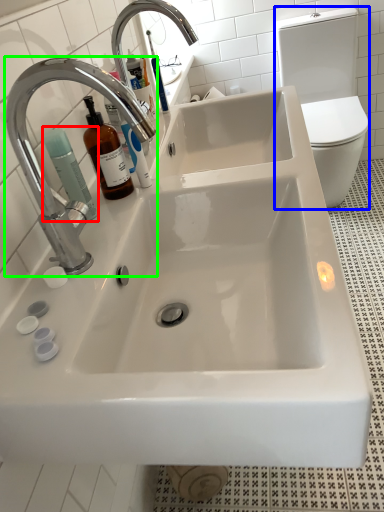
Question: Which object is the farthest from cleaning product (highlighted by a red box)? Choose among these: toilet bowl (highlighted by a blue box) or tap (highlighted by a green box).

Choices:
 (A) toilet bowl
 (B) tap

Answer: (A)